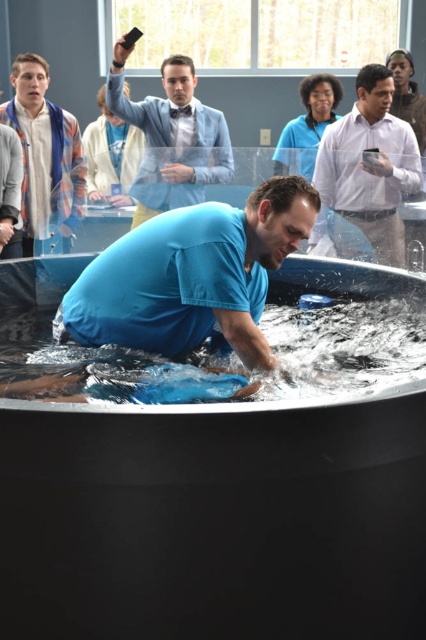
Consider the image. You are standing in the room and want to greet both the white shirt at upper right and the blue denim shirt at upper left. Which person should you approach first based on their positions?

You should approach the white shirt at upper right first because it is closer to you than the blue denim shirt at upper left.

You are a researcher in the lab and need to place a new equipment on the surface between the blue plastic tub at center and the light blue shirt at upper center. Can you place it there?

The blue plastic tub at center is in front of the light blue shirt at upper center, so there is no space between them for placing the equipment.